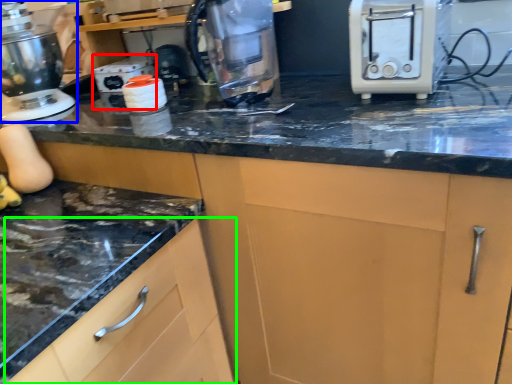
Question: Estimate the real-world distances between objects in this image. Which object is closer to appliance (highlighted by a red box), home appliance (highlighted by a blue box) or cabinetry (highlighted by a green box)?

Choices:
 (A) home appliance
 (B) cabinetry

Answer: (A)